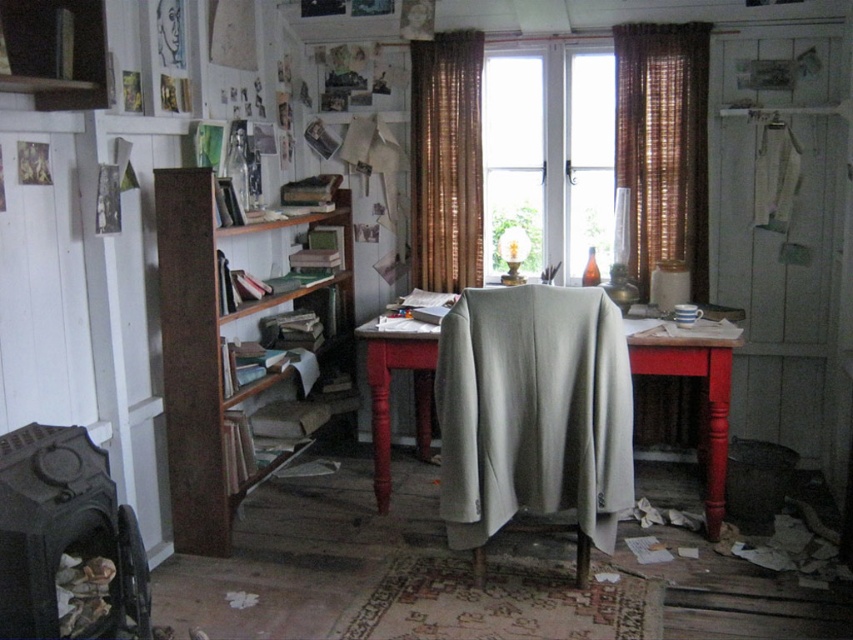
Does point (624, 138) come closer to viewer compared to point (426, 211)?

Yes, it is in front of point (426, 211).

Does brown woven curtain at right have a larger size compared to brown woven curtain at center?

Actually, brown woven curtain at right might be smaller than brown woven curtain at center.

The width and height of the screenshot is (853, 640). Identify the location of brown woven curtain at right. (663, 145).

Between point (589, 51) and point (439, 124), which one is positioned behind?

Point (439, 124)

Is white glass window at center wider than brown woven curtain at center?

Yes, white glass window at center is wider than brown woven curtain at center.

You are a GUI agent. You are given a task and a screenshot of the screen. Output one action in this format:
    pyautogui.click(x=<x>, y=<y>)
    Task: Click on the white glass window at center
    This screenshot has height=640, width=853.
    Given the screenshot: What is the action you would take?
    pyautogui.click(x=549, y=156)

Between brown woven curtain at right and smooth red wooden table at center, which one appears on the right side from the viewer's perspective?

brown woven curtain at right

This screenshot has height=640, width=853. What do you see at coordinates (663, 145) in the screenshot? I see `brown woven curtain at right` at bounding box center [663, 145].

The image size is (853, 640). What do you see at coordinates (663, 145) in the screenshot?
I see `brown woven curtain at right` at bounding box center [663, 145].

Identify the location of brown woven curtain at right. (663, 145).